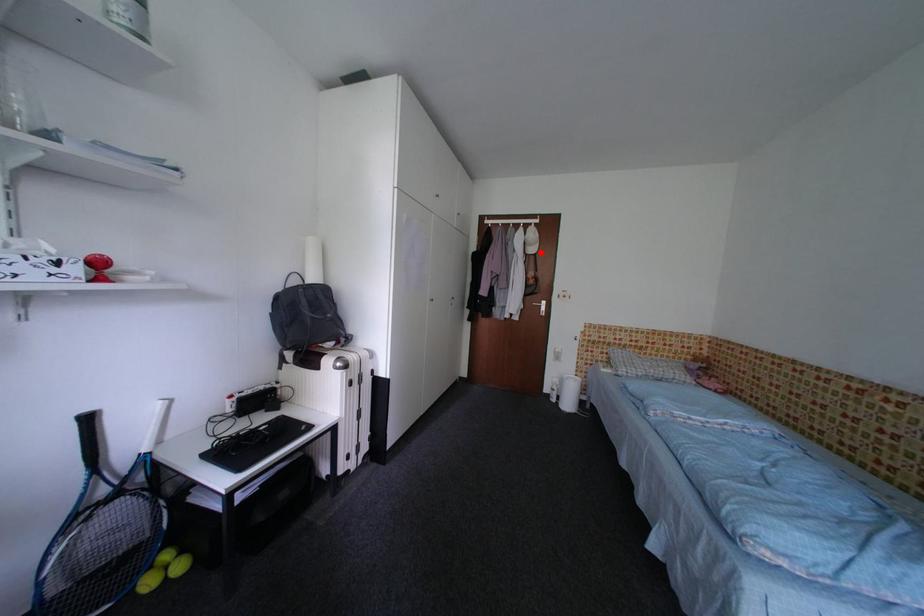
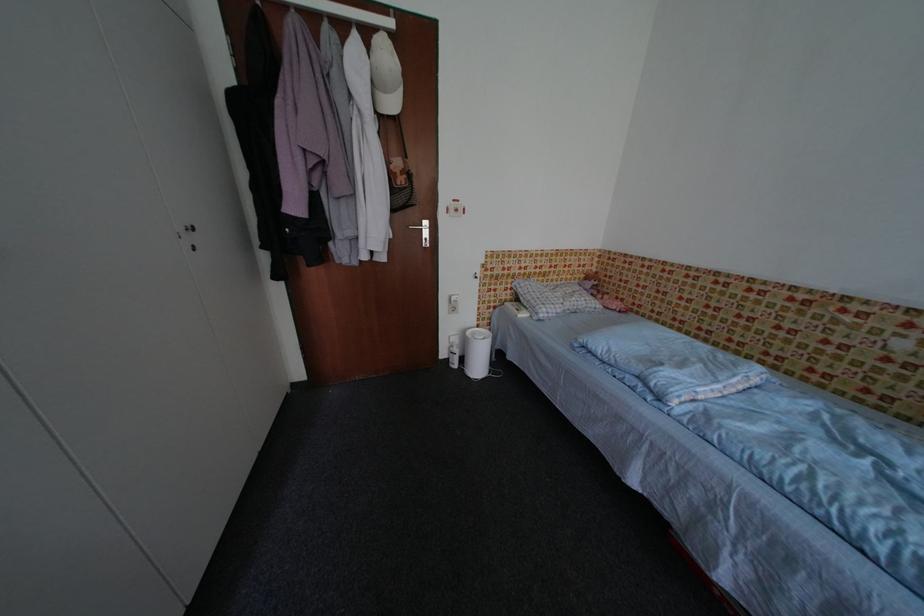
The point at the highlighted location is marked in the first image. Where is the corresponding point in the second image?

(400, 107)